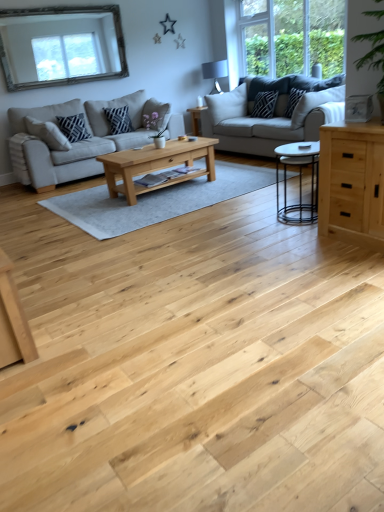
At what (x,y) coordinates should I click in order to perform the action: click on free spot to the left of black metal coffee table at center, the 2th coffee table in the back-to-front sequence. Please return your answer as a coordinate pair (x, y). The image size is (384, 512). Looking at the image, I should click on click(x=251, y=221).